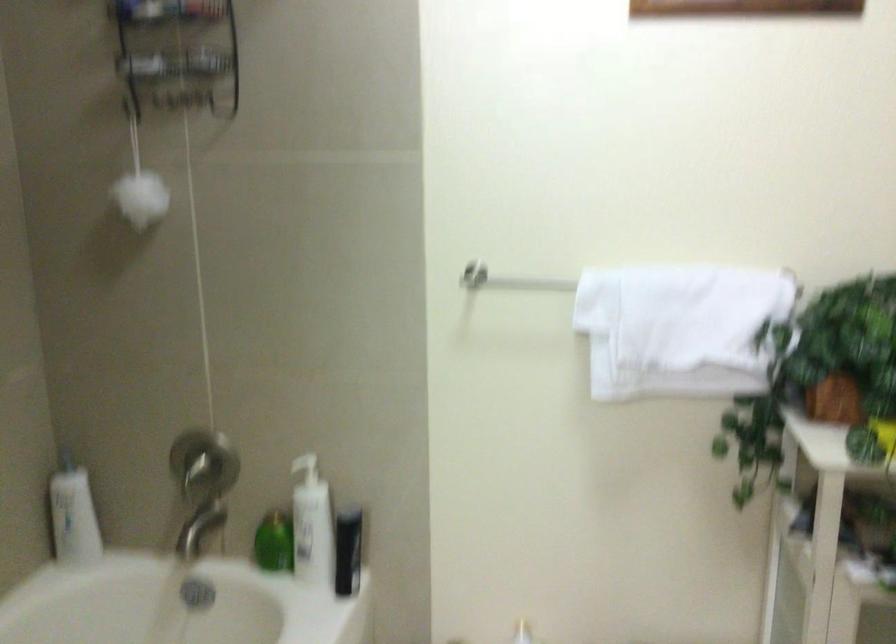
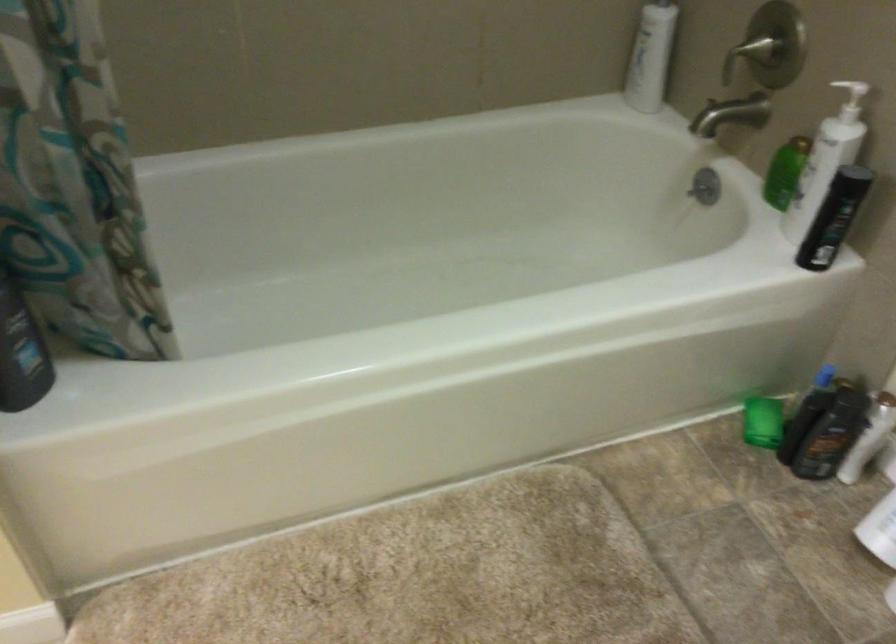
The first image is from the beginning of the video and the second image is from the end. How did the camera likely rotate when shooting the video?

The camera rotated toward left-down.